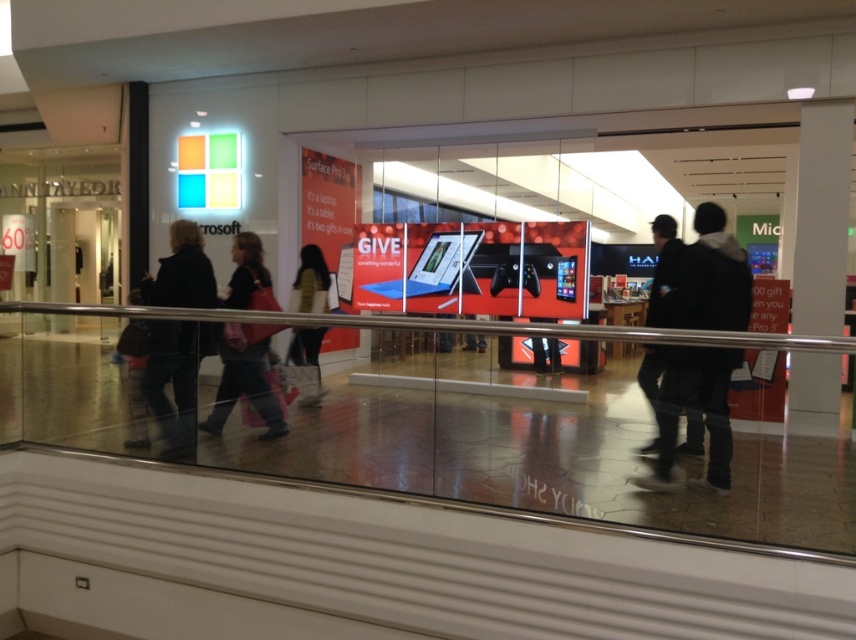
Between black fabric jacket at lower right and dark gray jacket at center, which one has more height?

Standing taller between the two is black fabric jacket at lower right.

Is black fabric jacket at lower right shorter than dark gray jacket at center?

No, black fabric jacket at lower right is not shorter than dark gray jacket at center.

This screenshot has width=856, height=640. What do you see at coordinates (698, 406) in the screenshot? I see `black fabric jacket at lower right` at bounding box center [698, 406].

You are a GUI agent. You are given a task and a screenshot of the screen. Output one action in this format:
    pyautogui.click(x=<x>, y=<y>)
    Task: Click on the black fabric jacket at lower right
    The image size is (856, 640).
    Given the screenshot: What is the action you would take?
    pyautogui.click(x=698, y=406)

Between black fabric jacket at left and matte black jacket at center, which one appears on the right side from the viewer's perspective?

From the viewer's perspective, matte black jacket at center appears more on the right side.

Can you confirm if black fabric jacket at left is bigger than matte black jacket at center?

No.

In order to click on black fabric jacket at left in this screenshot , I will do `click(176, 380)`.

Does black leather jacket at center have a larger size compared to dark gray jacket at center?

Correct, black leather jacket at center is larger in size than dark gray jacket at center.

Is black leather jacket at center closer to the viewer compared to dark gray jacket at center?

Yes, black leather jacket at center is closer to the viewer.

Image resolution: width=856 pixels, height=640 pixels. I want to click on black leather jacket at center, so click(663, 268).

This screenshot has width=856, height=640. Identify the location of black leather jacket at center. (663, 268).